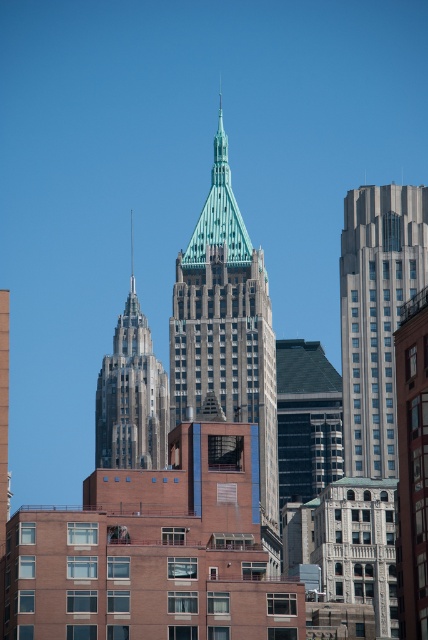
You are an architect evaluating the urban layout. Which building occupies more space in the cityscape between the green stone tower at center and the gray stone skyscraper at right?

The green stone tower at center is larger in size than the gray stone skyscraper at right, so it occupies more space in the cityscape.

You are a drone operator who needs to fly a drone between the green stone tower at center and the gray stone tower at left. The drone has a maximum flight distance of 35 meters. Can the drone safely fly between them without exceeding its range?

The green stone tower at center and gray stone tower at left are 36.90 meters apart from each other. Since the drone can only fly up to 35 meters, it cannot safely traverse the distance between them without exceeding its range.